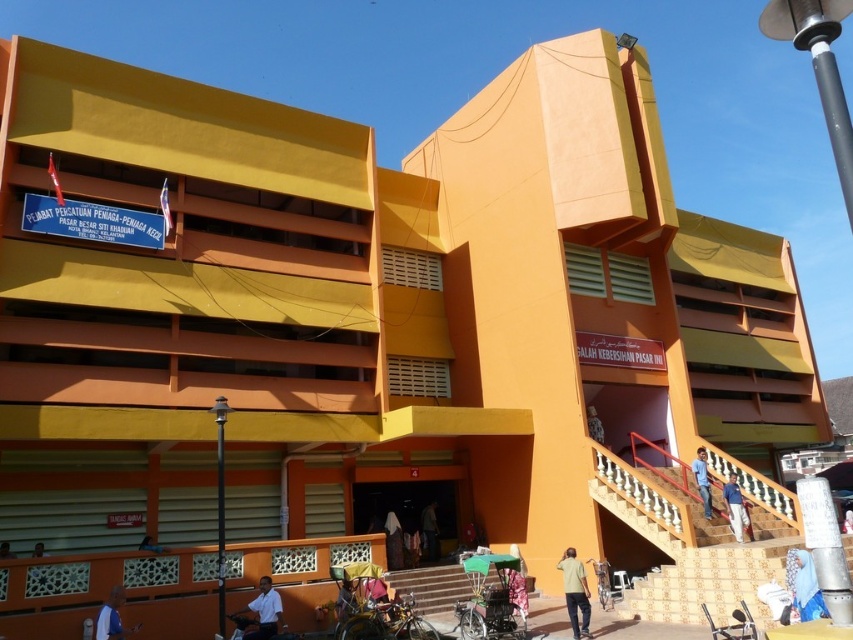
Is the position of blue fabric bag at center more distant than that of dark brown leather jacket at center?

That is False.

Which is more to the right, blue fabric bag at center or dark brown leather jacket at center?

From the viewer's perspective, blue fabric bag at center appears more on the right side.

Is point (793, 566) closer to camera compared to point (389, 529)?

Yes, it is in front of point (389, 529).

I want to click on blue fabric bag at center, so click(x=804, y=586).

Between white matte shirt at lower center and blue fabric shirt at lower left, which one is positioned higher?

blue fabric shirt at lower left is above.

Measure the distance between point (236, 625) and camera.

10.51 meters

This screenshot has height=640, width=853. What do you see at coordinates (260, 612) in the screenshot?
I see `white matte shirt at lower center` at bounding box center [260, 612].

The image size is (853, 640). In order to click on white matte shirt at lower center in this screenshot , I will do `click(260, 612)`.

From the picture: Which is more to the left, blue fabric pants at upper center or light brown wooden chair at center?

Positioned to the left is light brown wooden chair at center.

Between blue fabric pants at upper center and light brown wooden chair at center, which one is positioned higher?

blue fabric pants at upper center

What are the coordinates of `blue fabric pants at upper center` in the screenshot? It's located at (734, 508).

You are a GUI agent. You are given a task and a screenshot of the screen. Output one action in this format:
    pyautogui.click(x=<x>, y=<y>)
    Task: Click on the blue fabric pants at upper center
    Image resolution: width=853 pixels, height=640 pixels.
    Given the screenshot: What is the action you would take?
    pyautogui.click(x=734, y=508)